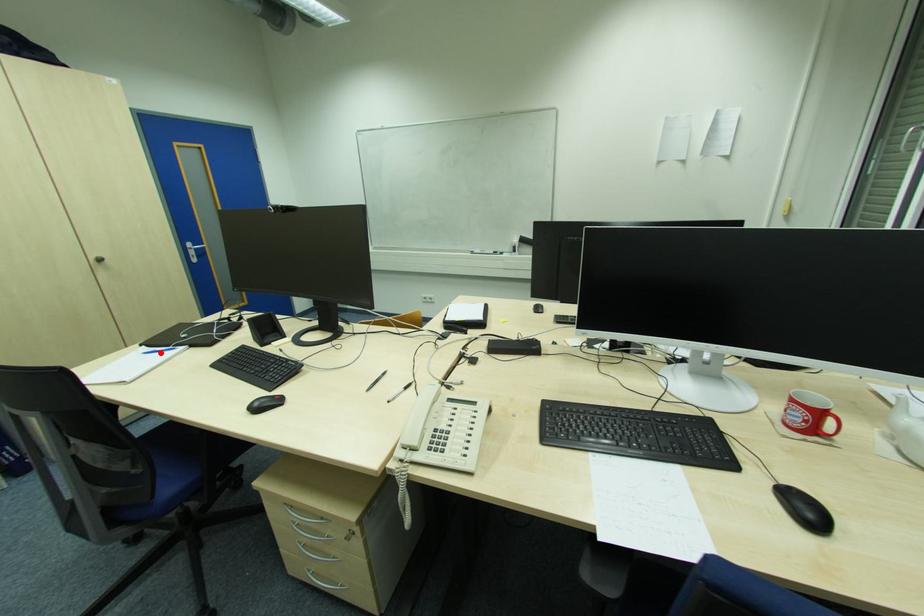
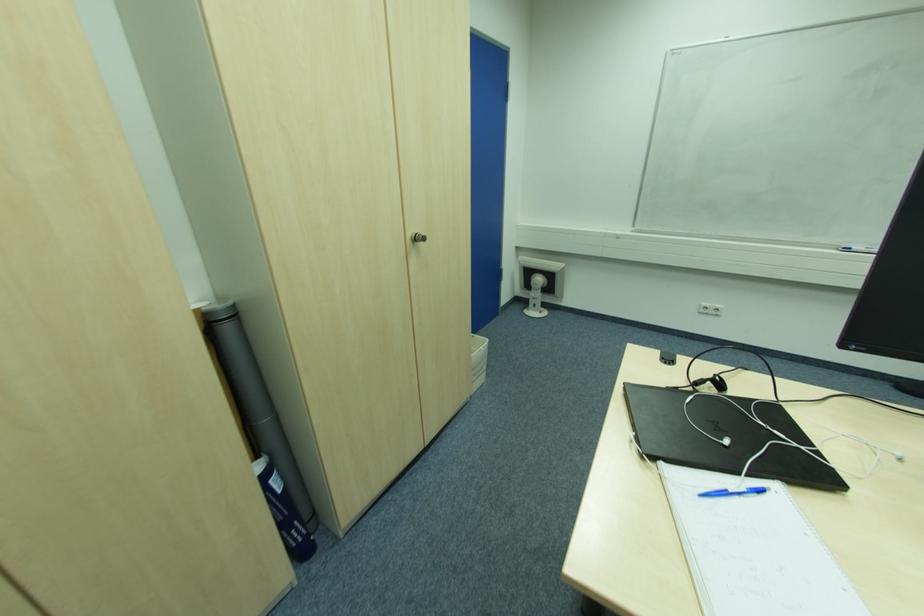
Where in the second image is the point corresponding to the highlighted location from the first image?

(727, 493)